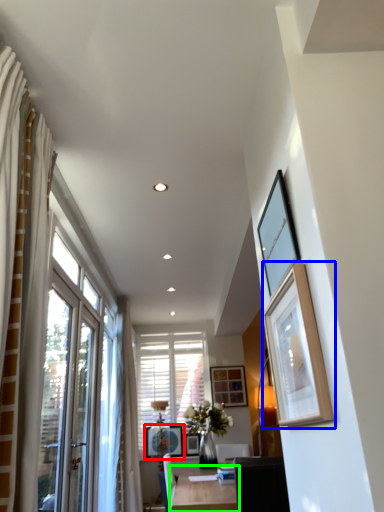
Question: Which object is the farthest from picture frame (highlighted by a red box)? Choose among these: picture frame (highlighted by a blue box) or table (highlighted by a green box).

Choices:
 (A) picture frame
 (B) table

Answer: (A)